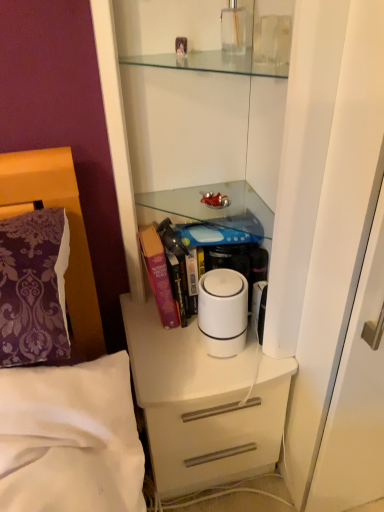
Locate an element on the screen. vacant area that lies between purple hardcover book at center and white plastic humidifier at center is located at coordinates (197, 352).